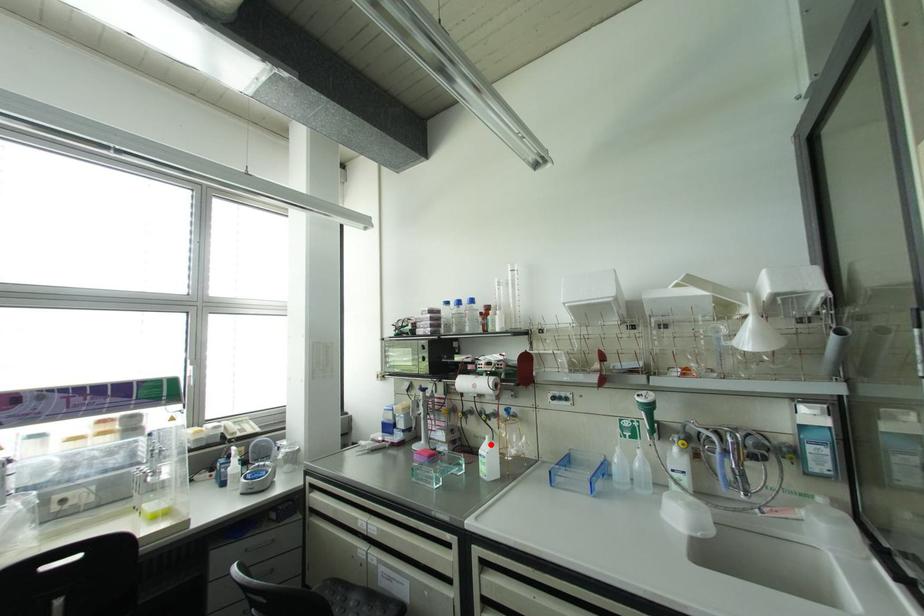
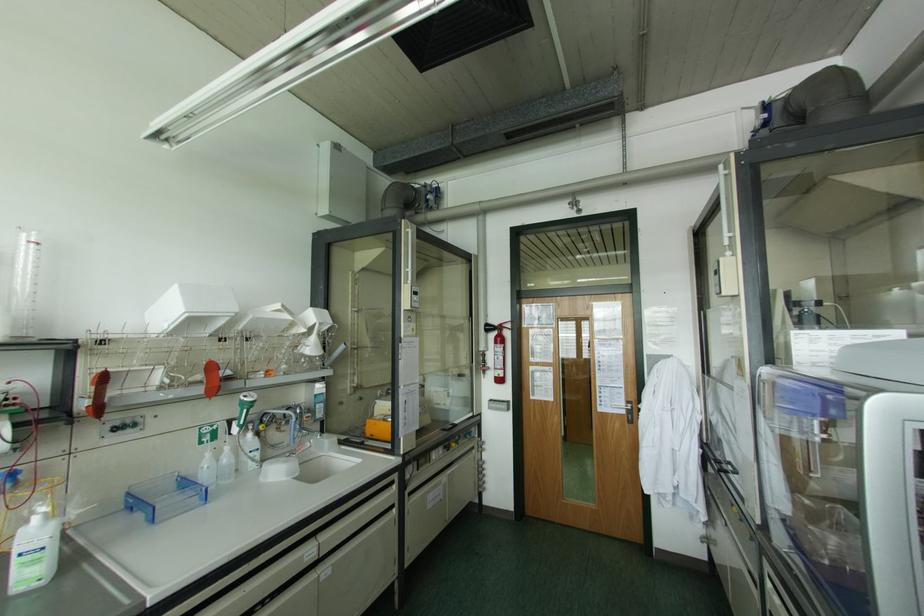
Question: I am providing you with two images of the same scene from different viewpoints. A red point is marked on the first image. At the location where the point appears in image 1, is it still visible in image 2?

Choices:
 (A) Yes
 (B) No

Answer: (A)